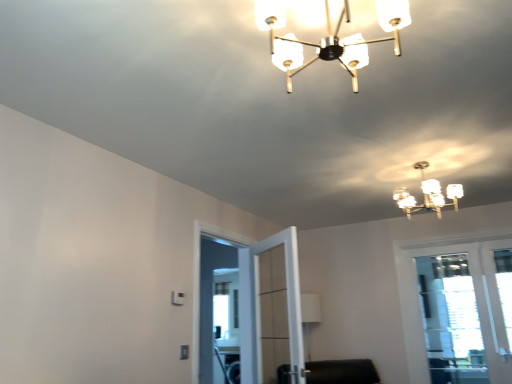
The width and height of the screenshot is (512, 384). What do you see at coordinates (426, 194) in the screenshot?
I see `white frosted glass chandelier at upper center, arranged as the 1th lamp when viewed from the right` at bounding box center [426, 194].

I want to click on clear glass door at right, so click(x=458, y=303).

Measure the distance between clear glass door at center and camera.

clear glass door at center is 9.42 feet away from camera.

This screenshot has height=384, width=512. Identify the location of translucent glass chandelier at upper center, which is the 1th lamp in front-to-back order. (329, 37).

Based on their positions, is translucent glass chandelier at upper center, the 2th lamp viewed from the right, located to the left or right of clear glass door at right?

In the image, translucent glass chandelier at upper center, the 2th lamp viewed from the right, appears on the left side of clear glass door at right.

From the image's perspective, which object appears higher, translucent glass chandelier at upper center, which is the 1th lamp in front-to-back order, or clear glass door at right?

From the image's view, translucent glass chandelier at upper center, which is the 1th lamp in front-to-back order, is above.

Is point (383, 15) behind point (402, 262)?

No.

Is translucent glass chandelier at upper center, the 2th lamp viewed from the right, wider or thinner than clear glass door at right?

In the image, translucent glass chandelier at upper center, the 2th lamp viewed from the right, appears to be wider than clear glass door at right.

Considering the sizes of clear glass door at right and translucent glass chandelier at upper center, which is the 2th lamp in back-to-front order, in the image, is clear glass door at right wider or thinner than translucent glass chandelier at upper center, which is the 2th lamp in back-to-front order,?

In the image, clear glass door at right appears to be more narrow than translucent glass chandelier at upper center, which is the 2th lamp in back-to-front order.

Considering the relative positions of clear glass door at right and translucent glass chandelier at upper center, positioned as the 1th lamp in top-to-bottom order, in the image provided, is clear glass door at right to the left or to the right of translucent glass chandelier at upper center, positioned as the 1th lamp in top-to-bottom order,?

clear glass door at right is positioned on translucent glass chandelier at upper center, positioned as the 1th lamp in top-to-bottom order,'s right side.

Considering the positions of objects clear glass door at right and translucent glass chandelier at upper center, positioned as the 1th lamp in top-to-bottom order, in the image provided, who is behind, clear glass door at right or translucent glass chandelier at upper center, positioned as the 1th lamp in top-to-bottom order,?

clear glass door at right.

Does clear glass door at right turn towards translucent glass chandelier at upper center, the second lamp when ordered from bottom to top?

Yes, clear glass door at right is aimed at translucent glass chandelier at upper center, the second lamp when ordered from bottom to top.

Find the location of a particular element. The width and height of the screenshot is (512, 384). window on the right of clear glass door at center is located at coordinates (458, 303).

Based on the photo, considering the sizes of clear glass door at center and clear glass door at right in the image, is clear glass door at center bigger or smaller than clear glass door at right?

In the image, clear glass door at center appears to be smaller than clear glass door at right.

Between clear glass door at center and clear glass door at right, which one has less height?

With less height is clear glass door at center.

From a real-world perspective, between white frosted glass chandelier at upper center, the second lamp in the front-to-back sequence, and clear glass door at right, who is vertically higher?

white frosted glass chandelier at upper center, the second lamp in the front-to-back sequence, is physically above.

Considering the positions of objects white frosted glass chandelier at upper center, arranged as the 1th lamp when viewed from the right, and clear glass door at right in the image provided, who is more to the right, white frosted glass chandelier at upper center, arranged as the 1th lamp when viewed from the right, or clear glass door at right?

clear glass door at right is more to the right.

Measure the distance between white frosted glass chandelier at upper center, arranged as the 1th lamp when viewed from the right, and clear glass door at right.

white frosted glass chandelier at upper center, arranged as the 1th lamp when viewed from the right, is 3.87 feet from clear glass door at right.

Does point (416, 163) come farther from viewer compared to point (416, 364)?

No, (416, 163) is closer to viewer.

Does clear glass door at right appear on the left side of clear glass door at center?

In fact, clear glass door at right is to the right of clear glass door at center.

Which of these two, clear glass door at right or clear glass door at center, stands shorter?

Standing shorter between the two is clear glass door at center.

From the image's perspective, is clear glass door at right positioned above or below clear glass door at center?

clear glass door at right is below clear glass door at center.

In the scene shown: Are clear glass door at right and clear glass door at center located far from each other?

Indeed, clear glass door at right is not near clear glass door at center.

From a real-world perspective, is clear glass door at center positioned above or below translucent glass chandelier at upper center, the 2th lamp viewed from the right?

In terms of real-world spatial position, clear glass door at center is below translucent glass chandelier at upper center, the 2th lamp viewed from the right.

Locate an element on the screen. This screenshot has width=512, height=384. screen door that is behind the translucent glass chandelier at upper center, which is the 2th lamp in back-to-front order is located at coordinates (271, 307).

Can you confirm if clear glass door at center is positioned to the right of translucent glass chandelier at upper center, the 2th lamp viewed from the right?

In fact, clear glass door at center is to the left of translucent glass chandelier at upper center, the 2th lamp viewed from the right.

Does clear glass door at center have a larger size compared to translucent glass chandelier at upper center, the second lamp when ordered from bottom to top?

Indeed, clear glass door at center has a larger size compared to translucent glass chandelier at upper center, the second lamp when ordered from bottom to top.

From the image's perspective, is translucent glass chandelier at upper center, the 2th lamp viewed from the right, beneath white frosted glass chandelier at upper center, which ranks as the 1th lamp in back-to-front order?

No, from the image's perspective, translucent glass chandelier at upper center, the 2th lamp viewed from the right, is not beneath white frosted glass chandelier at upper center, which ranks as the 1th lamp in back-to-front order.

Are translucent glass chandelier at upper center, the 2th lamp viewed from the right, and white frosted glass chandelier at upper center, which is the second lamp from left to right, far apart?

Yes.

Between translucent glass chandelier at upper center, positioned as the 1th lamp in top-to-bottom order, and white frosted glass chandelier at upper center, the second lamp in the front-to-back sequence, which one has smaller width?

With smaller width is white frosted glass chandelier at upper center, the second lamp in the front-to-back sequence.

Is point (405, 26) closer to viewer compared to point (459, 188)?

Yes, it is.

Where is `the 2nd lamp above the clear glass door at right (from the image's perspective)`? This screenshot has width=512, height=384. the 2nd lamp above the clear glass door at right (from the image's perspective) is located at coordinates (329, 37).

There is a clear glass door at right. Find the location of `the 1st lamp above it (from a real-world perspective)`. the 1st lamp above it (from a real-world perspective) is located at coordinates (329, 37).

From the image, which object appears to be farther from translucent glass chandelier at upper center, the second lamp when ordered from bottom to top, clear glass door at right or clear glass door at center?

clear glass door at right lies further to translucent glass chandelier at upper center, the second lamp when ordered from bottom to top, than the other object.

When comparing their distances from translucent glass chandelier at upper center, the second lamp when ordered from bottom to top, does clear glass door at right or white frosted glass chandelier at upper center, which ranks as the 1th lamp in back-to-front order, seem further?

clear glass door at right is positioned further to the anchor translucent glass chandelier at upper center, the second lamp when ordered from bottom to top.

Estimate the real-world distances between objects in this image. Which object is closer to white frosted glass chandelier at upper center, the second lamp in the front-to-back sequence, clear glass door at right or clear glass door at center?

Among the two, clear glass door at right is located nearer to white frosted glass chandelier at upper center, the second lamp in the front-to-back sequence.

Considering their positions, is white frosted glass chandelier at upper center, which is the second lamp from left to right, positioned further to clear glass door at right than translucent glass chandelier at upper center, the second lamp when ordered from bottom to top?

The object further to clear glass door at right is translucent glass chandelier at upper center, the second lamp when ordered from bottom to top.

Based on the photo, from the image, which object appears to be farther from white frosted glass chandelier at upper center, the 1th lamp positioned from the bottom, translucent glass chandelier at upper center, which is the 1th lamp in front-to-back order, or clear glass door at center?

Among the two, translucent glass chandelier at upper center, which is the 1th lamp in front-to-back order, is located further to white frosted glass chandelier at upper center, the 1th lamp positioned from the bottom.

Estimate the real-world distances between objects in this image. Which object is further from translucent glass chandelier at upper center, arranged as the first lamp when viewed from the left, clear glass door at center or white frosted glass chandelier at upper center, the 1th lamp positioned from the bottom?

clear glass door at center is positioned further to the anchor translucent glass chandelier at upper center, arranged as the first lamp when viewed from the left.

Considering their positions, is white frosted glass chandelier at upper center, which ranks as the 1th lamp in back-to-front order, positioned further to clear glass door at center than translucent glass chandelier at upper center, arranged as the first lamp when viewed from the left?

translucent glass chandelier at upper center, arranged as the first lamp when viewed from the left, lies further to clear glass door at center than the other object.

Based on their spatial positions, is translucent glass chandelier at upper center, which is the 1th lamp in front-to-back order, or clear glass door at right closer to white frosted glass chandelier at upper center, the 1th lamp positioned from the bottom?

Among the two, clear glass door at right is located nearer to white frosted glass chandelier at upper center, the 1th lamp positioned from the bottom.

You are a GUI agent. You are given a task and a screenshot of the screen. Output one action in this format:
    pyautogui.click(x=<x>, y=<y>)
    Task: Click on the lamp between translucent glass chandelier at upper center, the second lamp when ordered from bottom to top, and clear glass door at center in the front-back direction
    
    Given the screenshot: What is the action you would take?
    pyautogui.click(x=426, y=194)

At what (x,y) coordinates should I click in order to perform the action: click on lamp located between translucent glass chandelier at upper center, positioned as the 1th lamp in top-to-bottom order, and clear glass door at right in the depth direction. Please return your answer as a coordinate pair (x, y). This screenshot has height=384, width=512. Looking at the image, I should click on (426, 194).

The height and width of the screenshot is (384, 512). Identify the location of screen door between translucent glass chandelier at upper center, positioned as the 1th lamp in top-to-bottom order, and clear glass door at right, along the z-axis. (271, 307).